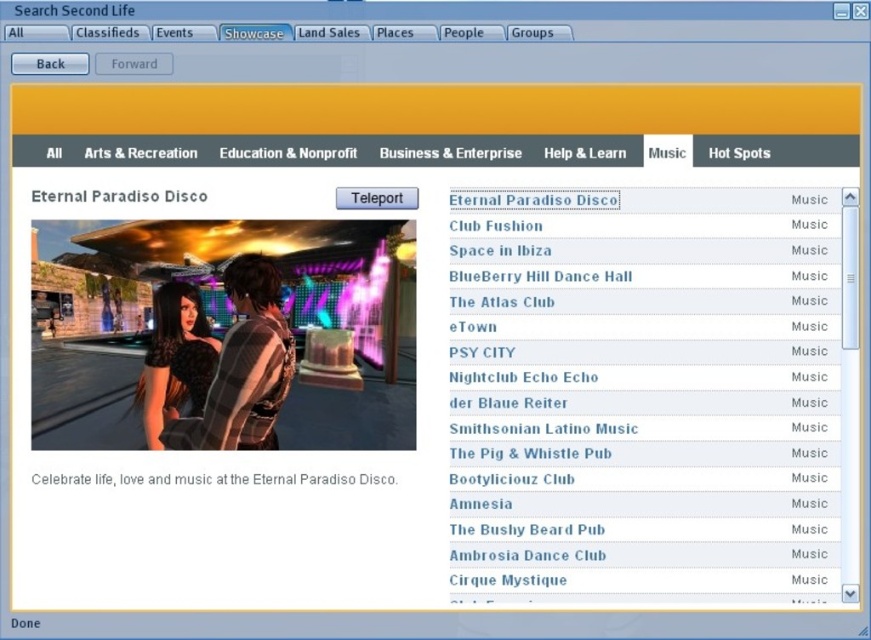
Question: Which object is closer to the camera taking this photo?

Choices:
 (A) white text on black background at center
 (B) shiny black dress at center

Answer: (A)

Question: Is shiny black dress at center below white text on black background at center?

Choices:
 (A) no
 (B) yes

Answer: (A)

Question: Does shiny black dress at center come behind white text on black background at center?

Choices:
 (A) yes
 (B) no

Answer: (A)

Question: Can you confirm if shiny black dress at center is wider than white text on black background at center?

Choices:
 (A) yes
 (B) no

Answer: (A)